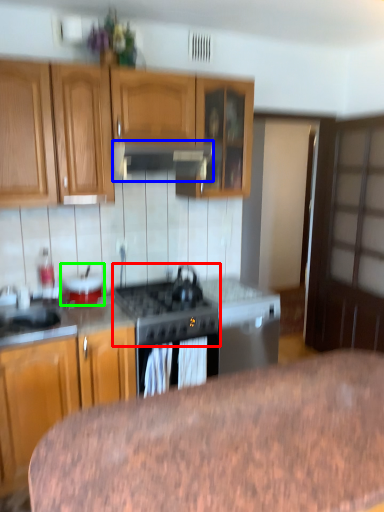
Question: Which object is positioned closest to gas stove (highlighted by a red box)? Select from exhaust hood (highlighted by a blue box) and appliance (highlighted by a green box).

Choices:
 (A) exhaust hood
 (B) appliance

Answer: (B)